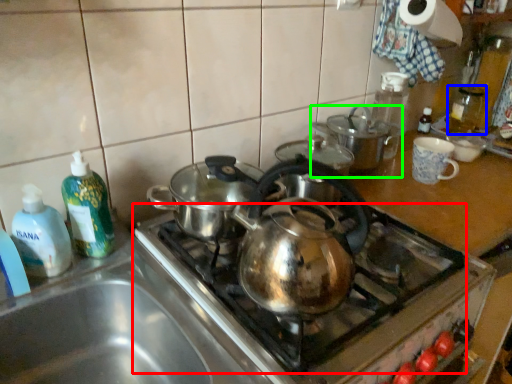
Question: Which object is the closest to the gas stove (highlighted by a red box)? Choose among these: bottle (highlighted by a blue box) or kitchen appliance (highlighted by a green box).

Choices:
 (A) bottle
 (B) kitchen appliance

Answer: (B)